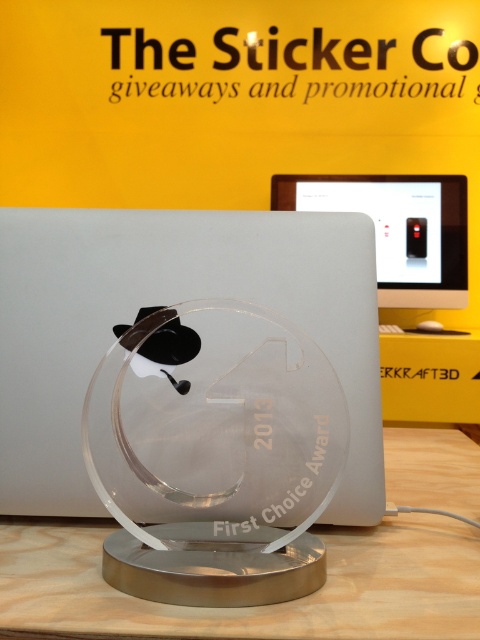
Question: Which is nearer to the black plastic mouse at center?

Choices:
 (A) clear acrylic table at center
 (B) white plastic monitor at center

Answer: (B)

Question: Does clear acrylic table at center appear on the right side of black plastic mouse at center?

Choices:
 (A) no
 (B) yes

Answer: (A)

Question: Which point is closer to the camera taking this photo?

Choices:
 (A) (12, 490)
 (B) (291, 188)
 (C) (430, 324)

Answer: (A)

Question: Which object is the farthest from the black plastic mouse at center?

Choices:
 (A) white plastic monitor at center
 (B) clear acrylic table at center

Answer: (B)

Question: Can you confirm if satin silver laptop at center is wider than white plastic monitor at center?

Choices:
 (A) yes
 (B) no

Answer: (B)

Question: Is clear acrylic table at center thinner than black plastic mouse at center?

Choices:
 (A) yes
 (B) no

Answer: (B)